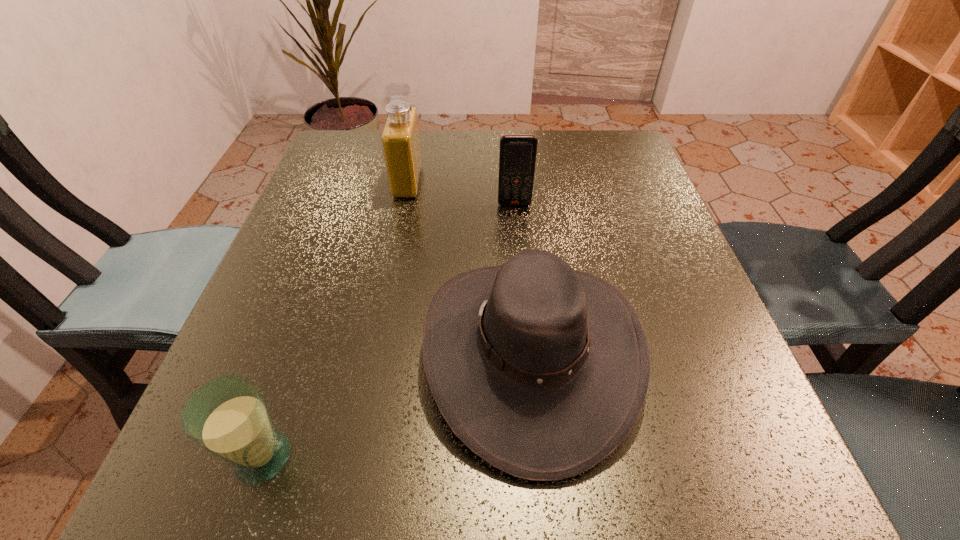
Where is `the tallest object`? the tallest object is located at coordinates (400, 138).

Find the location of a particular element. The image size is (960, 540). the farthest object is located at coordinates (400, 138).

I want to click on cellular telephone, so [517, 156].

Image resolution: width=960 pixels, height=540 pixels. I want to click on cowboy hat, so click(x=541, y=370).

At what (x,y) coordinates should I click in order to perform the action: click on glass. Please return your answer as a coordinate pair (x, y). The image size is (960, 540). Looking at the image, I should click on (228, 417).

Image resolution: width=960 pixels, height=540 pixels. Find the location of `vacant region located on the front-facing side of the third object from right to left`. vacant region located on the front-facing side of the third object from right to left is located at coordinates (588, 182).

I want to click on free spot located on the screen of the second farthest object, so click(529, 359).

Locate an element on the screen. The height and width of the screenshot is (540, 960). free region located 0.150m on the front-facing side of the cowboy hat is located at coordinates (325, 352).

This screenshot has width=960, height=540. What are the coordinates of `vacant region located on the front-facing side of the cowboy hat` in the screenshot? It's located at (393, 352).

What are the coordinates of `vacant space located on the front-facing side of the cowboy hat` in the screenshot? It's located at (266, 352).